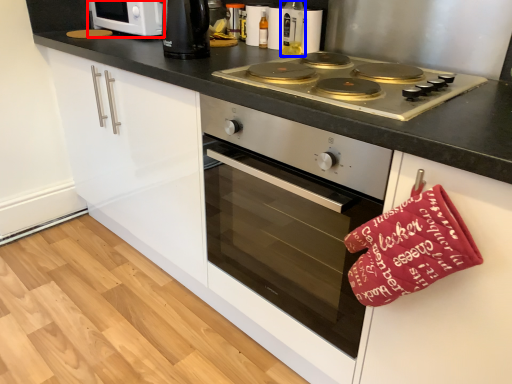
Question: Which object appears farthest to the camera in this image, home appliance (highlighted by a red box) or bottle (highlighted by a blue box)?

Choices:
 (A) home appliance
 (B) bottle

Answer: (A)